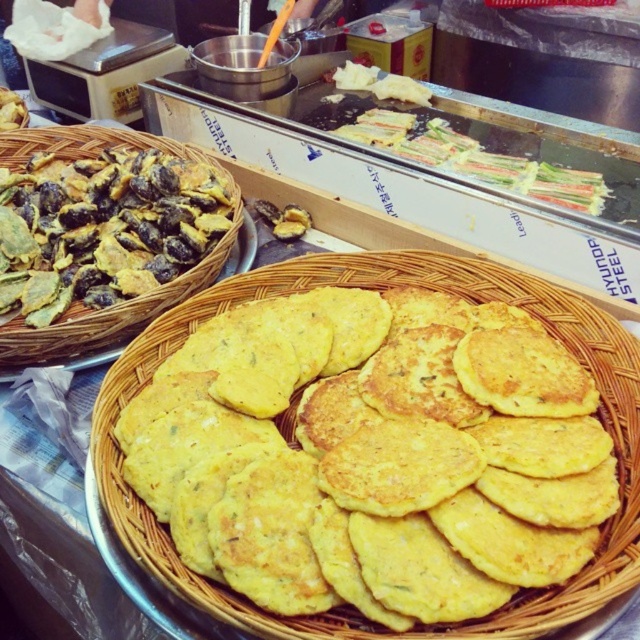
You are a food vendor who needs to place both the yellow matte pancake basket at center and the yellow crispy chips at left on a narrow shelf that can only hold items up to 30 cm in width. Given their sizes, which item should you place first to ensure both fit?

The yellow crispy chips at left should be placed first since its width is smaller than the yellow matte pancake basket at center. By placing the narrower item first, there will be enough space left for the wider basket, ensuring both fit within the 30 cm shelf width.